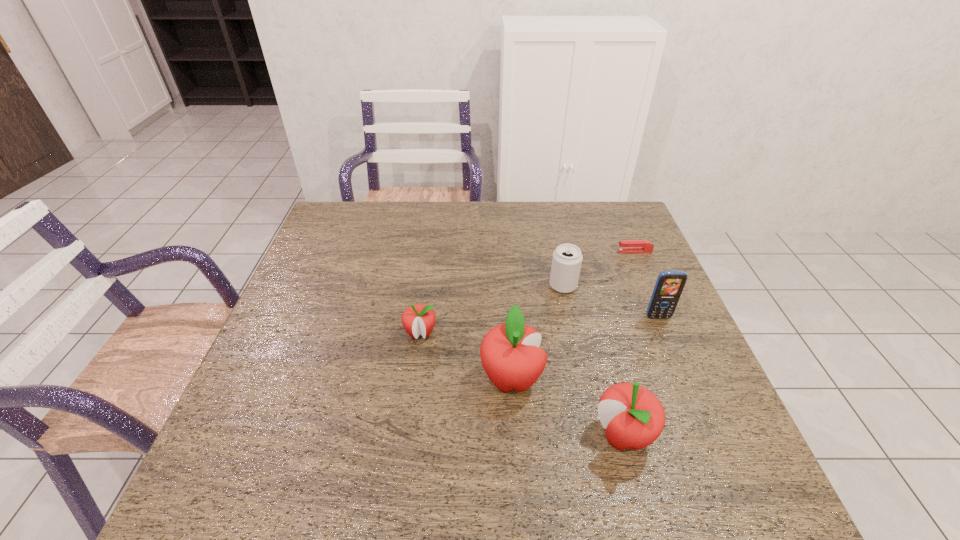
The width and height of the screenshot is (960, 540). In order to click on apple that is the second closest to the second object from left to right in this screenshot , I will do `click(418, 319)`.

Image resolution: width=960 pixels, height=540 pixels. I want to click on apple that can be found as the closest to the shortest apple, so click(510, 354).

Image resolution: width=960 pixels, height=540 pixels. In order to click on free space that satisfies the following two spatial constraints: 1. on the front-facing side of the shortest object; 2. on the screen of the third farthest object in this screenshot , I will do `click(663, 318)`.